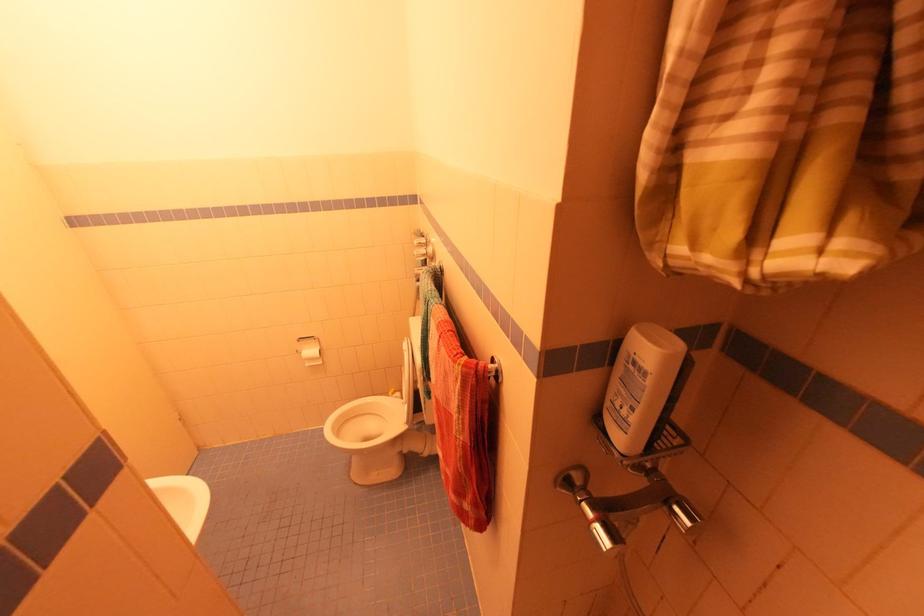
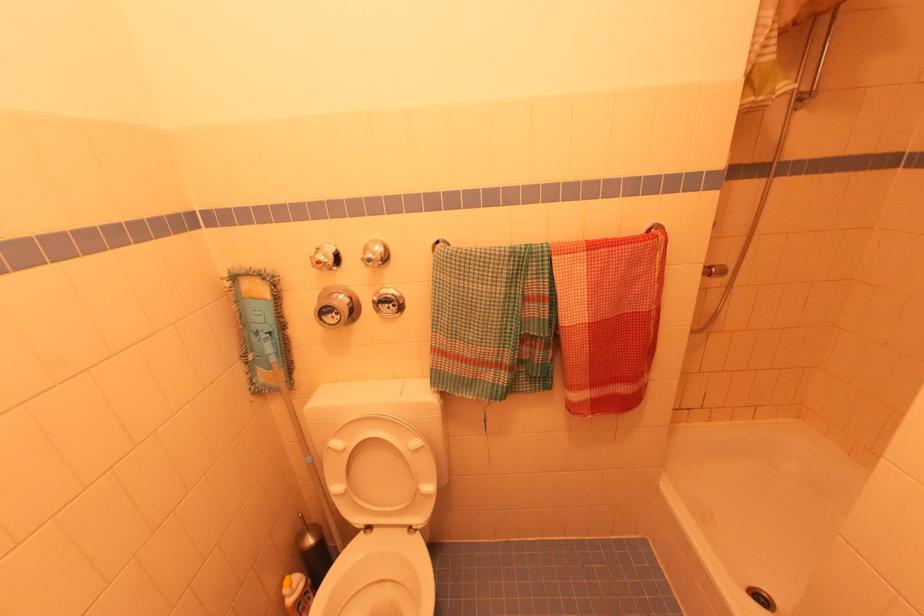
Find the pixel in the second image that matches pixel 396 395 in the first image.

(296, 585)